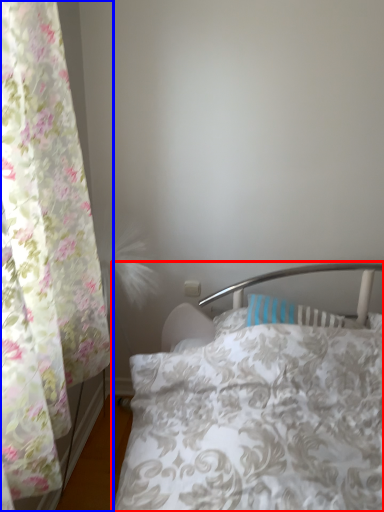
Question: Which object is further to the camera taking this photo, bed (highlighted by a red box) or curtain (highlighted by a blue box)?

Choices:
 (A) bed
 (B) curtain

Answer: (A)